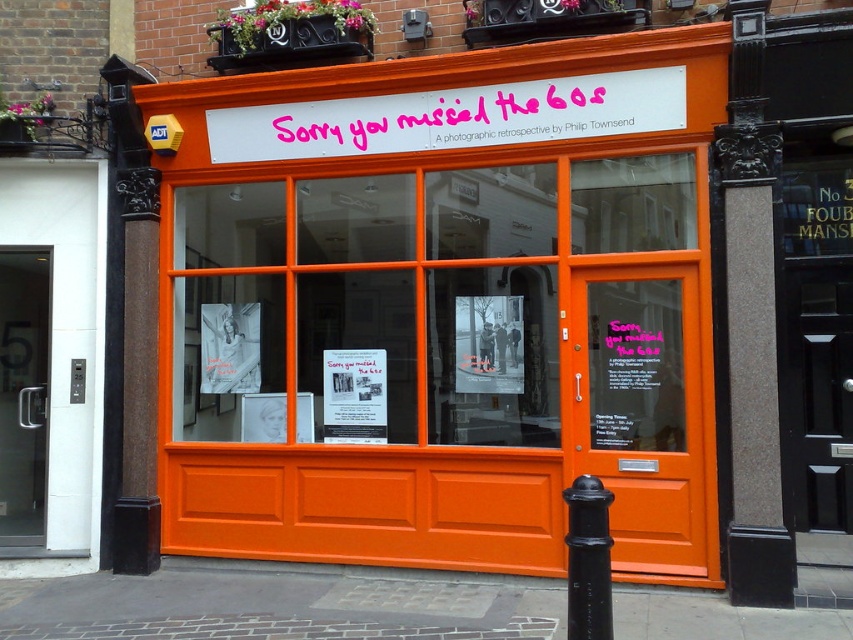
Question: Is white plastic signboard at upper center below black matte pole at lower right?

Choices:
 (A) no
 (B) yes

Answer: (A)

Question: Which object appears farthest from the camera in this image?

Choices:
 (A) white plastic signboard at upper center
 (B) black matte pole at lower right

Answer: (A)

Question: In this image, where is white plastic signboard at upper center located relative to black matte pole at lower right?

Choices:
 (A) right
 (B) left

Answer: (B)

Question: Is white plastic signboard at upper center positioned before black matte pole at lower right?

Choices:
 (A) no
 (B) yes

Answer: (A)